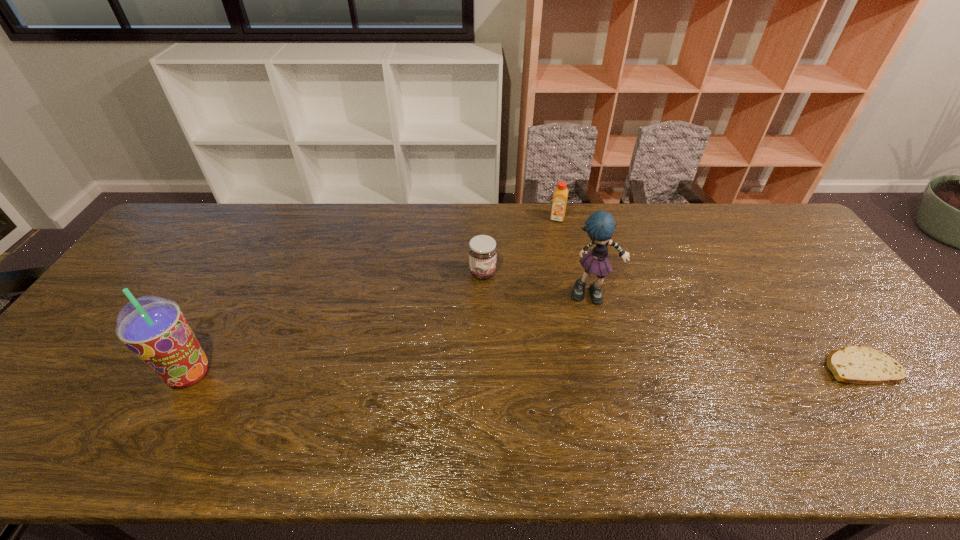
Find the location of a particular element. Image resolution: width=960 pixels, height=540 pixels. free region located on the front label of the second shortest object is located at coordinates (577, 336).

You are a GUI agent. You are given a task and a screenshot of the screen. Output one action in this format:
    pyautogui.click(x=<x>, y=<y>)
    Task: Click on the vacant space situated 0.360m on the front label of the second shortest object
    
    Given the screenshot: What is the action you would take?
    pyautogui.click(x=593, y=347)

At what (x,y) coordinates should I click in order to perform the action: click on free space located 0.300m on the front label of the second shortest object. Please return your answer as a coordinate pair (x, y). Looking at the image, I should click on (574, 335).

At what (x,y) coordinates should I click in order to perform the action: click on free space located on the front and back of the farthest object. Please return your answer as a coordinate pair (x, y). This screenshot has width=960, height=540. Looking at the image, I should click on (550, 256).

The image size is (960, 540). I want to click on free spot located on the front and back of the farthest object, so click(x=545, y=280).

Image resolution: width=960 pixels, height=540 pixels. In order to click on free space located on the front and back of the farthest object in this screenshot , I will do `click(542, 299)`.

What are the coordinates of `vacant space located 0.270m on the front-facing side of the third nearest object` in the screenshot? It's located at (611, 390).

Find the location of `vacant position located 0.100m on the front-facing side of the third nearest object`. vacant position located 0.100m on the front-facing side of the third nearest object is located at coordinates (600, 334).

Locate an element on the screen. The image size is (960, 540). vacant space located 0.120m on the front-facing side of the third nearest object is located at coordinates (601, 340).

The height and width of the screenshot is (540, 960). Find the location of `object positioned at the far edge`. object positioned at the far edge is located at coordinates (560, 195).